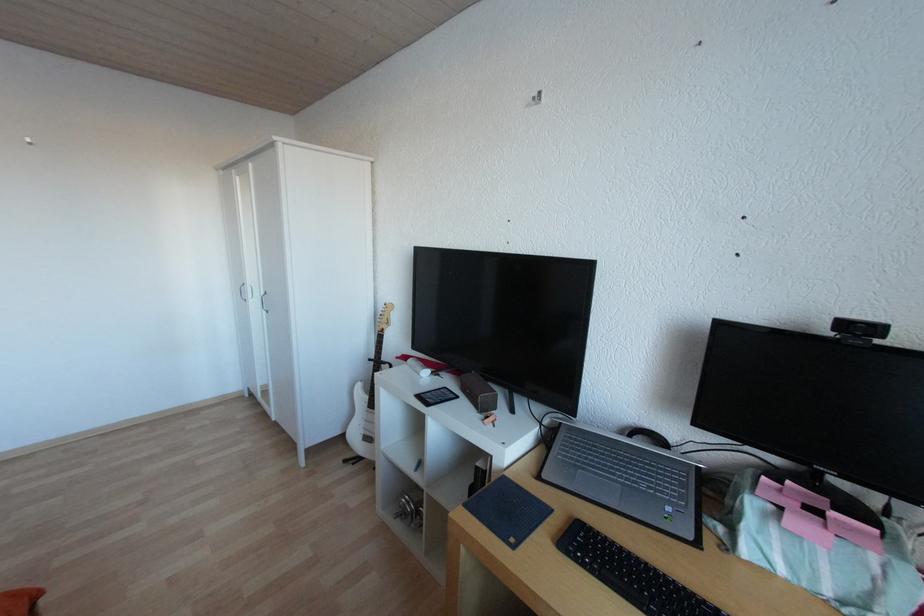
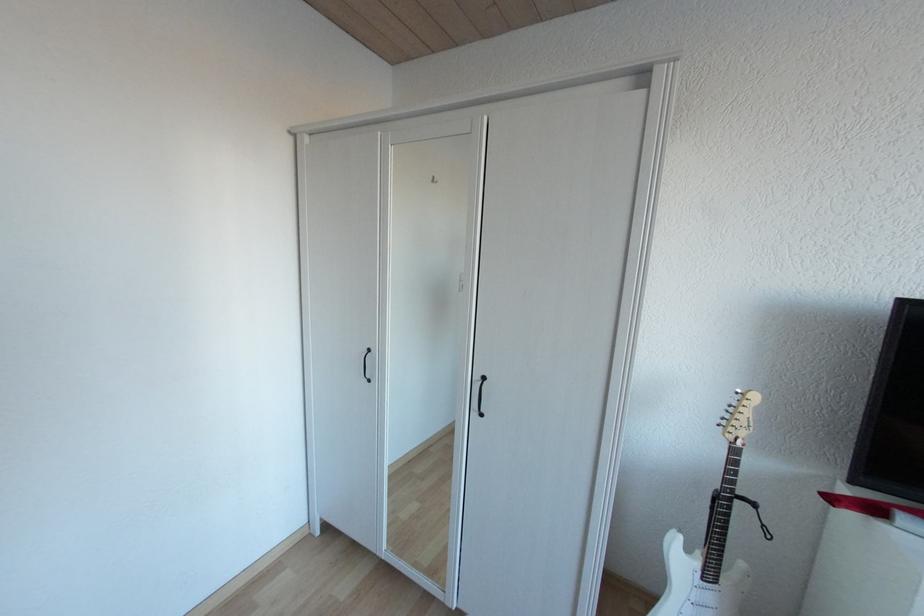
In a continuous first-person perspective shot, in which direction is the camera moving?

Answer: The cameraman walked toward left, forward.